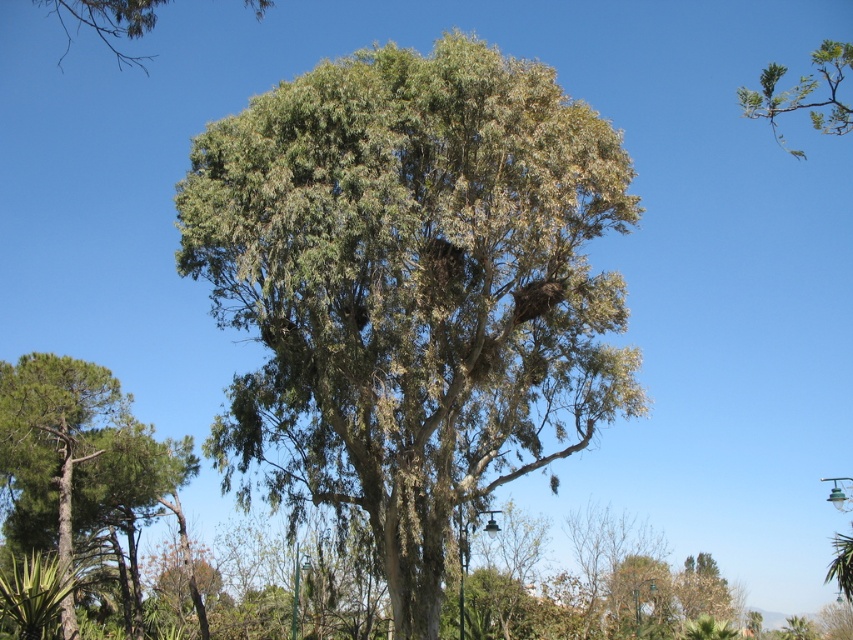
Based on the photo, you are standing in front of the large eucalyptus tree with dense green leaves. There are two points marked on the tree trunk. One is at coordinates point (57, 456) and the other is at point (762, 97). Which point is closer to you?

Point (57, 456) is closer to you because it is further to the viewer than point (762, 97).

You are a bird looking for a place to perch. You see the green leafy tree at center and the green leafy branch at upper right. Which one has a wider area to land on?

The green leafy branch at upper right has a wider area to land on because it is wider than the green leafy tree at center.